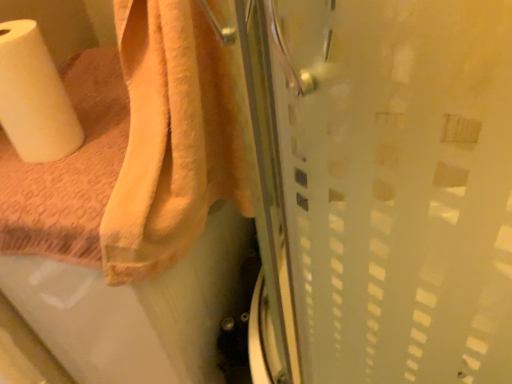
Question: Is white matte paper towel at left bigger or smaller than orange cotton towel at upper left?

Choices:
 (A) small
 (B) big

Answer: (A)

Question: Visually, is white matte paper towel at left positioned to the left or to the right of orange cotton towel at upper left?

Choices:
 (A) right
 (B) left

Answer: (B)

Question: From the image's perspective, is white matte paper towel at left above or below orange cotton towel at upper left?

Choices:
 (A) below
 (B) above

Answer: (B)

Question: Do you think orange cotton towel at upper left is within white matte paper towel at left, or outside of it?

Choices:
 (A) inside
 (B) outside

Answer: (B)

Question: In terms of width, does orange cotton towel at upper left look wider or thinner when compared to white matte paper towel at left?

Choices:
 (A) wide
 (B) thin

Answer: (A)

Question: In the image, is orange cotton towel at upper left positioned in front of or behind white matte paper towel at left?

Choices:
 (A) behind
 (B) front

Answer: (B)

Question: In terms of size, does orange cotton towel at upper left appear bigger or smaller than white matte paper towel at left?

Choices:
 (A) small
 (B) big

Answer: (B)